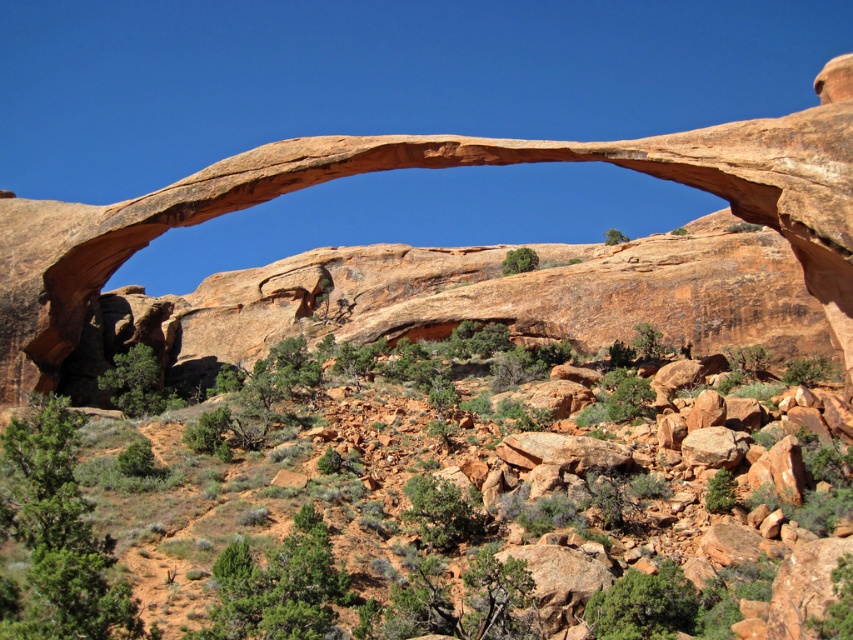
Question: Which is nearer to the rustic sandstone arch at center?

Choices:
 (A) rustic stone arch at center
 (B) rusty rock at center

Answer: (B)

Question: Does rustic sandstone arch at center have a larger size compared to rusty rock at center?

Choices:
 (A) no
 (B) yes

Answer: (B)

Question: Estimate the real-world distances between objects in this image. Which object is farther from the rustic sandstone arch at center?

Choices:
 (A) rusty rock at center
 (B) rustic stone arch at center

Answer: (B)

Question: Which point is closer to the camera?

Choices:
 (A) (810, 291)
 (B) (55, 518)

Answer: (B)

Question: Is rustic stone arch at center bigger than rustic sandstone arch at center?

Choices:
 (A) no
 (B) yes

Answer: (A)

Question: Can you confirm if rustic sandstone arch at center is wider than rusty rock at center?

Choices:
 (A) no
 (B) yes

Answer: (B)